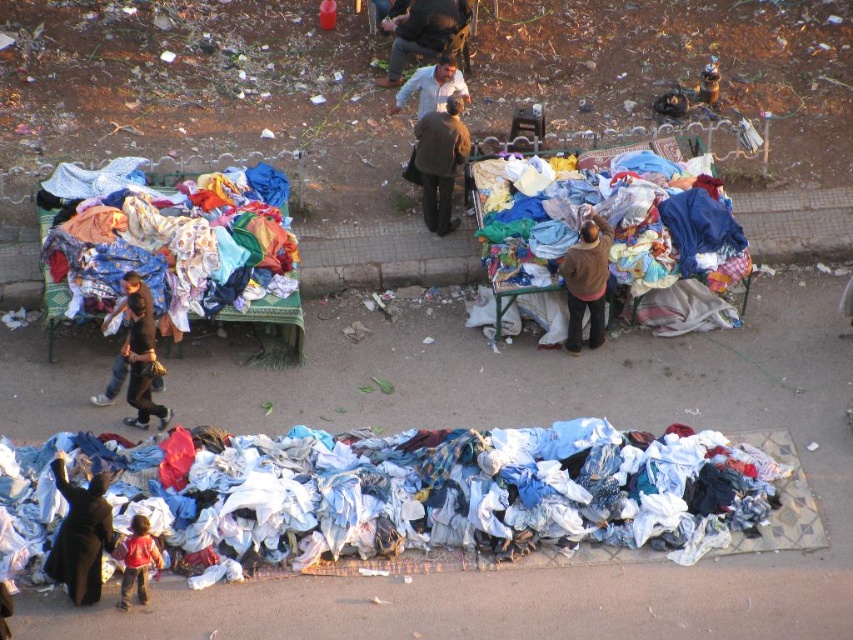
Question: Is matte brown coat at center behind red cotton shirt at lower left?

Choices:
 (A) yes
 (B) no

Answer: (A)

Question: Can you confirm if brown woolen sweater at center is thinner than red cotton shirt at lower left?

Choices:
 (A) no
 (B) yes

Answer: (A)

Question: Which object is farther from the camera taking this photo?

Choices:
 (A) red cotton shirt at lower left
 (B) white cotton laundry at lower center
 (C) multicolored fabric at left
 (D) matte brown jacket at upper center

Answer: (D)

Question: Which of the following is the closest to the observer?

Choices:
 (A) white matte shirt at center
 (B) matte brown coat at center
 (C) dark brown fabric at lower left

Answer: (C)

Question: Which is nearer to the matte brown coat at center?

Choices:
 (A) white matte shirt at center
 (B) dark brown fabric at lower left
 (C) multicolored fabric at center

Answer: (A)

Question: Can you confirm if white cotton laundry at lower center is wider than matte brown jacket at upper center?

Choices:
 (A) no
 (B) yes

Answer: (B)